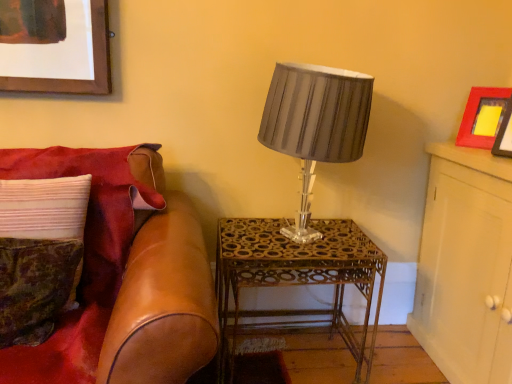
At what (x,y) coordinates should I click in order to perform the action: click on vacant space underneath matte gray fabric lampshade at center (from a real-world perspective). Please return your answer as a coordinate pair (x, y). This screenshot has width=512, height=384. Looking at the image, I should click on (319, 233).